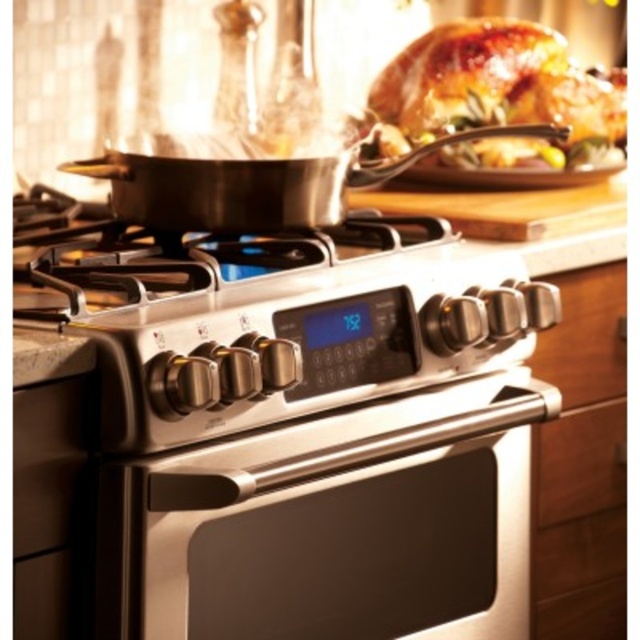
Is satin nickel oven at center taller than shiny silver frying pan at upper center?

Yes, satin nickel oven at center is taller than shiny silver frying pan at upper center.

Does point (272, 433) lie behind point (141, 221)?

That is False.

Does point (227, 634) lie behind point (371, 172)?

That is False.

Locate an element on the screen. satin nickel oven at center is located at coordinates (332, 525).

Can you confirm if satin nickel oven at center is shorter than stainless steel gas stove at center?

Incorrect, satin nickel oven at center's height does not fall short of stainless steel gas stove at center's.

Between satin nickel oven at center and stainless steel gas stove at center, which one is positioned lower?

satin nickel oven at center is below.

Which is in front, point (472, 536) or point (140, 260)?

Point (140, 260)

Identify the location of satin nickel oven at center. The height and width of the screenshot is (640, 640). (332, 525).

Which is in front, point (468, 356) or point (68, 289)?

Positioned in front is point (68, 289).

From the picture: Who is taller, stainless steel gas stove at center or satin nickel gas stove at center?

stainless steel gas stove at center is taller.

Does point (308, 388) lie behind point (33, 216)?

No, (308, 388) is in front of (33, 216).

Find the location of a particular element. stainless steel gas stove at center is located at coordinates (276, 321).